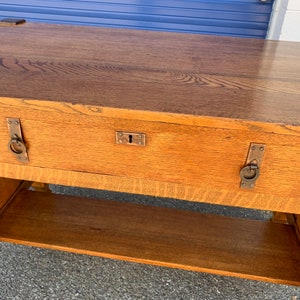
Locate an element on the screen. The height and width of the screenshot is (300, 300). blue wall, metal is located at coordinates (71, 6).